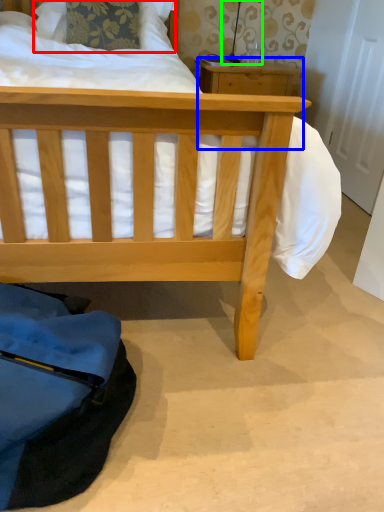
Question: Which is farther away from pillow (highlighted by a red box)? table (highlighted by a blue box) or table lamp (highlighted by a green box)?

Choices:
 (A) table
 (B) table lamp

Answer: (A)